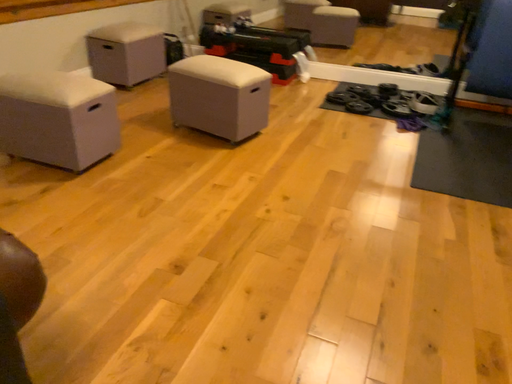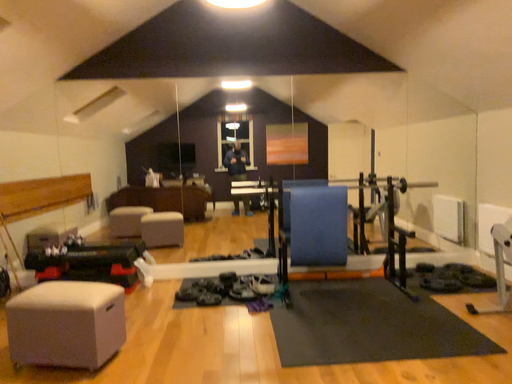
Question: Which way did the camera rotate in the video?

Choices:
 (A) rotated left
 (B) rotated right

Answer: (B)